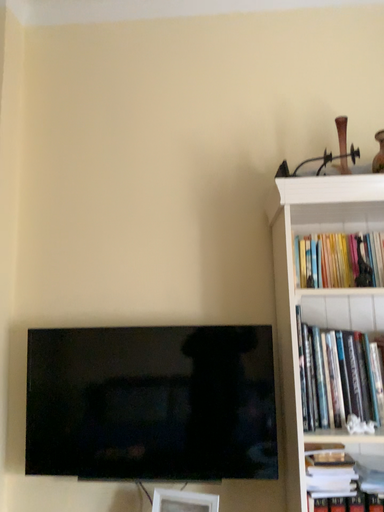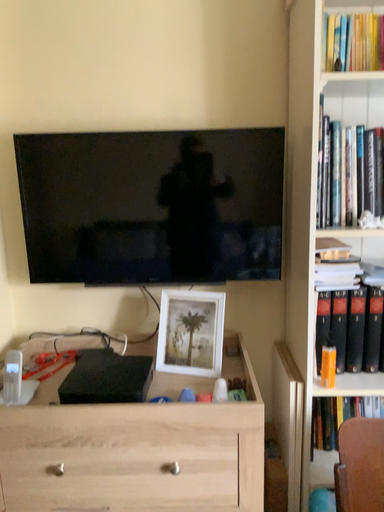
Question: Which way did the camera rotate in the video?

Choices:
 (A) rotated upward
 (B) rotated downward

Answer: (B)